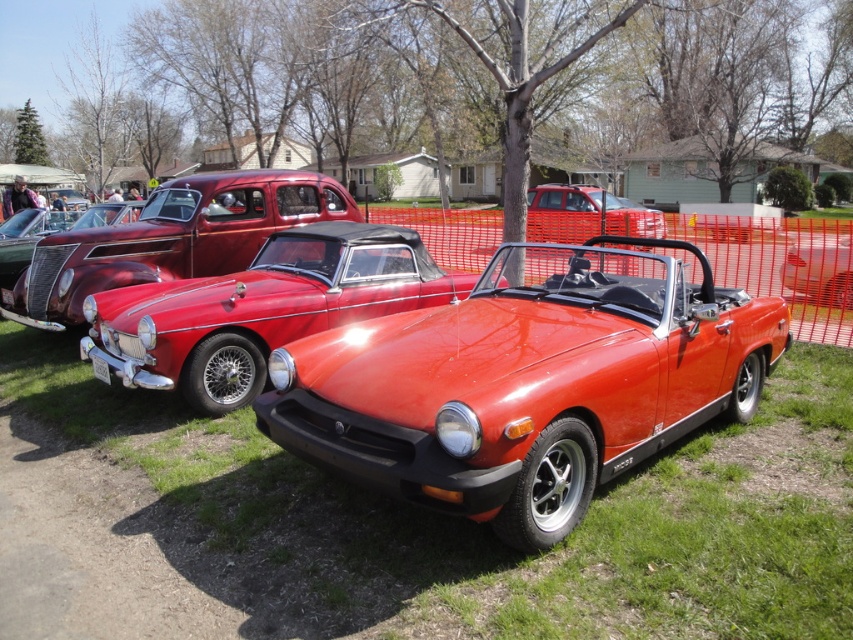
Question: Is glossy red convertible at center bigger than metallic red convertible at center?

Choices:
 (A) yes
 (B) no

Answer: (B)

Question: Which object is positioned farthest from the metallic red convertible at center?

Choices:
 (A) glossy red convertible at center
 (B) shiny red convertible at center

Answer: (B)

Question: Which point is farther to the camera?

Choices:
 (A) (247, 324)
 (B) (457, 333)

Answer: (A)

Question: Is shiny red convertible at center above metallic red convertible at center?

Choices:
 (A) yes
 (B) no

Answer: (B)

Question: Which object is closer to the camera taking this photo?

Choices:
 (A) metallic red convertible at center
 (B) glossy red convertible at center
 (C) shiny red convertible at center

Answer: (C)

Question: Is glossy red convertible at center to the right of metallic red convertible at center from the viewer's perspective?

Choices:
 (A) yes
 (B) no

Answer: (B)